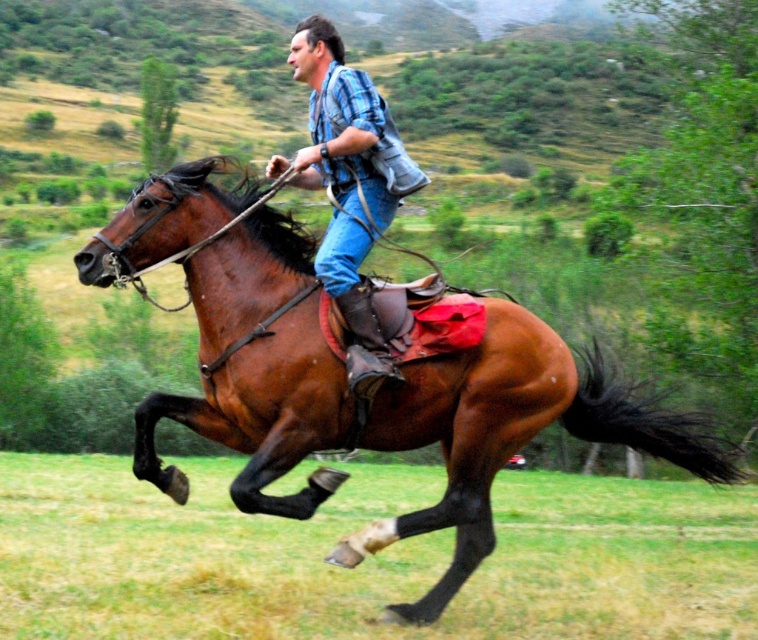
Can you confirm if green grass at lower center is smaller than plaid shirt at center?

No.

Based on the photo, who is more distant from viewer, (89, 458) or (331, 132)?

Positioned behind is point (89, 458).

Locate an element on the screen. The image size is (758, 640). green grass at lower center is located at coordinates (367, 557).

Is brown leather horse at center below plaid shirt at center?

Indeed, brown leather horse at center is positioned under plaid shirt at center.

Does brown leather horse at center appear on the right side of plaid shirt at center?

Yes, brown leather horse at center is to the right of plaid shirt at center.

Who is more forward, (547, 337) or (401, 184)?

Point (547, 337) is in front.

Find the location of a particular element. The height and width of the screenshot is (640, 758). brown leather horse at center is located at coordinates (509, 433).

Who is lower down, green grass at lower center or brown leather horse at center?

green grass at lower center

Is green grass at lower center positioned before brown leather horse at center?

No, it is behind brown leather horse at center.

Between point (688, 579) and point (453, 472), which one is positioned in front?

Point (453, 472) is more forward.

Where is `green grass at lower center`? Image resolution: width=758 pixels, height=640 pixels. green grass at lower center is located at coordinates (367, 557).